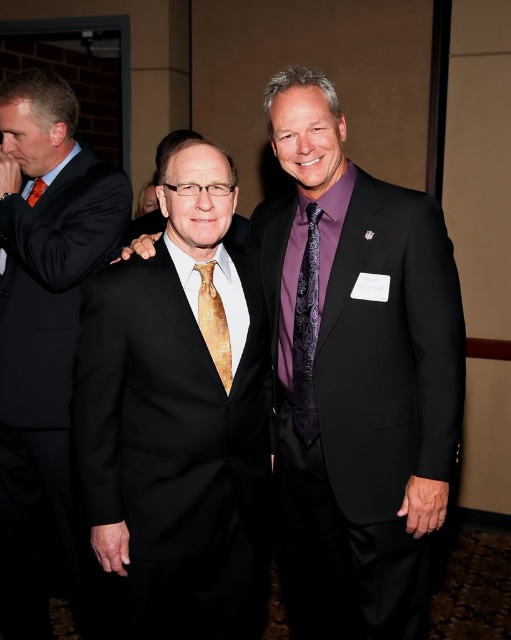
Is matte black suit at left positioned before purple satin tie at center?

No, it is behind purple satin tie at center.

Image resolution: width=511 pixels, height=640 pixels. I want to click on matte black suit at left, so click(x=45, y=339).

Where is `matte black suit at left`? The height and width of the screenshot is (640, 511). matte black suit at left is located at coordinates (45, 339).

Can you confirm if black satin suit at center is wider than orange silk tie at left?

Yes, black satin suit at center is wider than orange silk tie at left.

Does black satin suit at center have a smaller size compared to orange silk tie at left?

No, black satin suit at center is not smaller than orange silk tie at left.

Image resolution: width=511 pixels, height=640 pixels. I want to click on black satin suit at center, so click(x=175, y=451).

Which is below, matte black suit at center or orange silk tie at left?

Positioned lower is matte black suit at center.

Is point (359, 348) farther from camera compared to point (38, 193)?

No.

Identify the location of matte black suit at center. This screenshot has height=640, width=511. (359, 378).